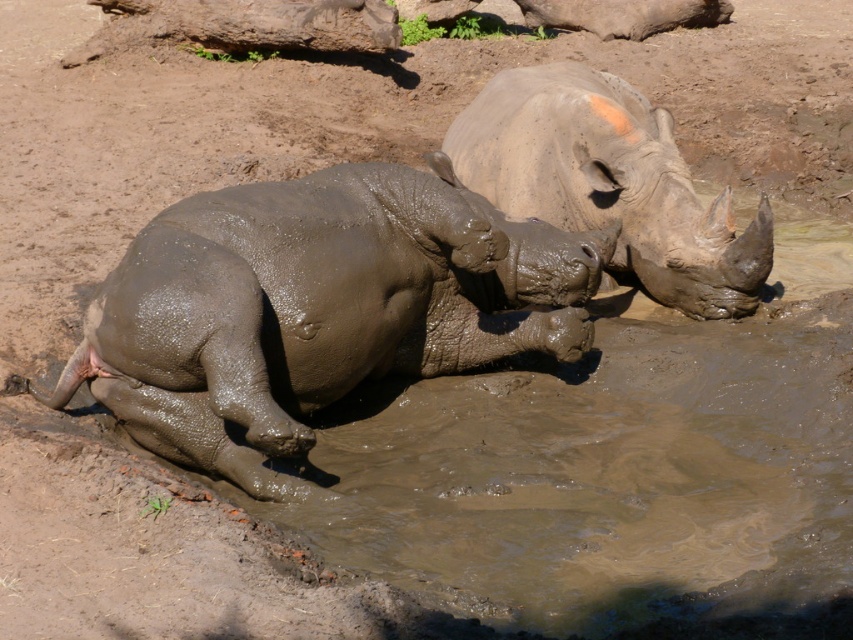
Question: Where is muddy gray rhino at left located in relation to gray matte rhinoceros at upper right in the image?

Choices:
 (A) left
 (B) right

Answer: (A)

Question: Which point is farther to the camera?

Choices:
 (A) (125, 412)
 (B) (462, 170)

Answer: (B)

Question: Is muddy gray rhino at left bigger than gray matte rhinoceros at upper right?

Choices:
 (A) no
 (B) yes

Answer: (B)

Question: Is muddy gray rhino at left further to the viewer compared to gray matte rhinoceros at upper right?

Choices:
 (A) yes
 (B) no

Answer: (B)